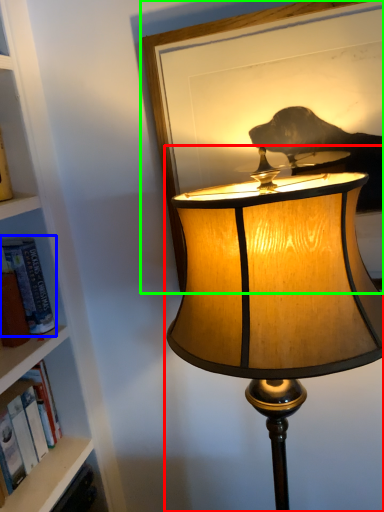
Question: Based on their relative distances, which object is nearer to lamp (highlighted by a red box)? Choose from book (highlighted by a blue box) and picture frame (highlighted by a green box).

Choices:
 (A) book
 (B) picture frame

Answer: (B)